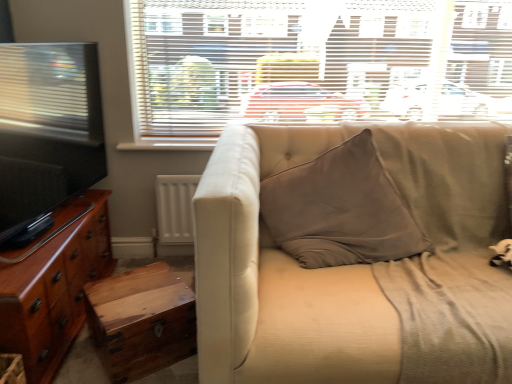
Question: In terms of width, does white textured blinds at upper center look wider or thinner when compared to wooden trunk at lower left?

Choices:
 (A) wide
 (B) thin

Answer: (B)

Question: Considering the positions of point (214, 13) and point (145, 278), is point (214, 13) closer or farther from the camera than point (145, 278)?

Choices:
 (A) farther
 (B) closer

Answer: (A)

Question: Estimate the real-world distances between objects in this image. Which object is farther from the glossy wood cabinet at left?

Choices:
 (A) white textured blinds at upper center
 (B) wooden trunk at lower left
 (C) beige fabric couch at center

Answer: (A)

Question: Based on their relative distances, which object is farther from the wooden trunk at lower left?

Choices:
 (A) white textured blinds at upper center
 (B) beige fabric couch at center
 (C) glossy wood cabinet at left

Answer: (A)